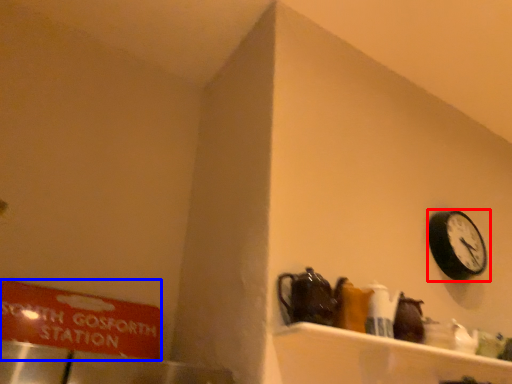
Question: Which of the following is the closest to the observer, wall clock (highlighted by a red box) or sign (highlighted by a blue box)?

Choices:
 (A) wall clock
 (B) sign

Answer: (B)